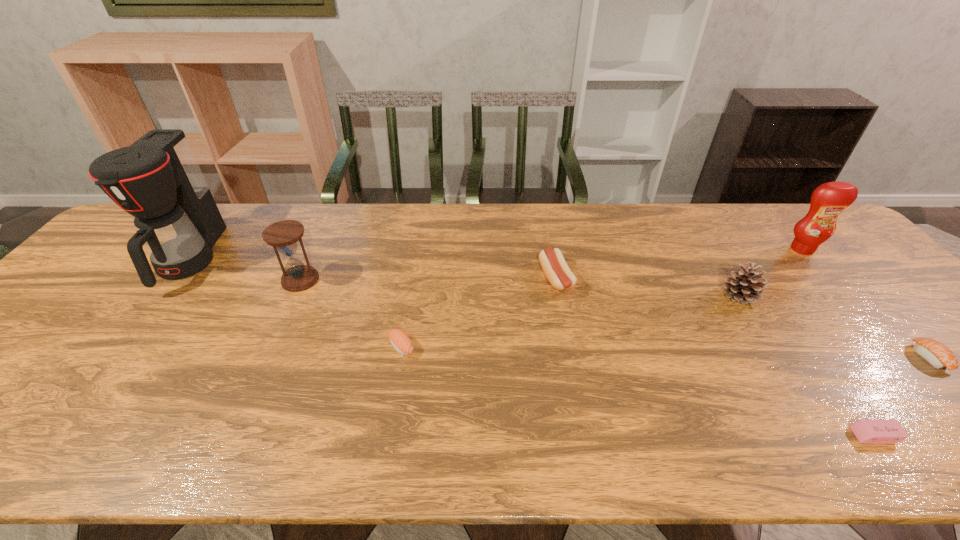
This screenshot has height=540, width=960. Identify the location of empty space that is in between the nearest object and the seventh object from right to left. (588, 357).

I want to click on free area in between the fourth shortest object and the second tallest object, so click(x=679, y=264).

At what (x,y) coordinates should I click in order to perform the action: click on vacant region between the fourth object from left to right and the third object from left to right. Please return your answer as a coordinate pair (x, y). The height and width of the screenshot is (540, 960). Looking at the image, I should click on (478, 312).

Locate which object is the fourth closest to the nearest object. Please provide its 2D coordinates. Your answer should be formatted as a tuple, i.e. [(x, y)], where the tuple contains the x and y coordinates of a point satisfying the conditions above.

[(556, 270)]

Locate an element on the screen. This screenshot has height=540, width=960. the sixth closest object to the sixth shortest object is located at coordinates (828, 200).

You are a GUI agent. You are given a task and a screenshot of the screen. Output one action in this format:
    pyautogui.click(x=<x>, y=<y>)
    Task: Click on the free space that satisfies the following two spatial constraints: 1. pour from the carafe of the eraser; 2. on the right side of the tallest object
    
    Given the screenshot: What is the action you would take?
    pyautogui.click(x=54, y=435)

Locate an element on the screen. Image resolution: width=960 pixels, height=540 pixels. free spot that satisfies the following two spatial constraints: 1. pour from the carafe of the right sushi; 2. on the right side of the coffee maker is located at coordinates (113, 357).

You are a GUI agent. You are given a task and a screenshot of the screen. Output one action in this format:
    pyautogui.click(x=<x>, y=<y>)
    Task: Click on the vacant area that satisfies the following two spatial constraints: 1. pour from the carafe of the leftmost object; 2. on the right side of the shortest object
    The width and height of the screenshot is (960, 540).
    Given the screenshot: What is the action you would take?
    pyautogui.click(x=54, y=435)

At what (x,y) coordinates should I click in order to perform the action: click on vacant space that satisfies the following two spatial constraints: 1. pour from the carafe of the tallest object; 2. on the left side of the fifth shortest object. Please return your answer as a coordinate pair (x, y). The height and width of the screenshot is (540, 960). Looking at the image, I should click on (160, 296).